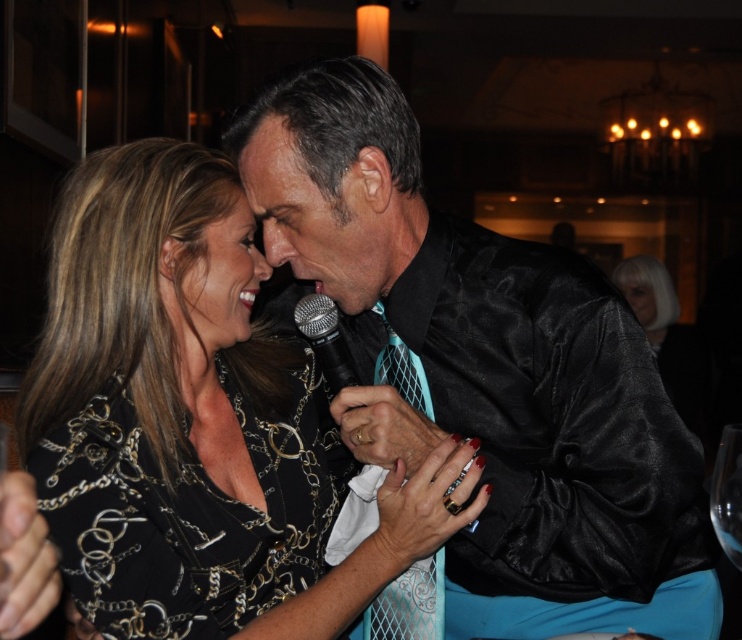
Which is more to the right, transparent glass at lower right or black metallic microphone at center?

transparent glass at lower right

Does transparent glass at lower right appear over black metallic microphone at center?

Incorrect, transparent glass at lower right is not positioned above black metallic microphone at center.

Locate an element on the screen. transparent glass at lower right is located at coordinates (728, 515).

Between point (692, 618) and point (177, 417), which one is positioned in front?

Point (177, 417) is more forward.

Is point (338, 64) more distant than point (70, 554)?

That is True.

Locate an element on the screen. This screenshot has height=640, width=742. black satin shirt at center is located at coordinates (487, 372).

Can you confirm if silvery metallic jacket at upper right is positioned to the right of black metallic microphone at center?

Correct, you'll find silvery metallic jacket at upper right to the right of black metallic microphone at center.

Does point (706, 388) come behind point (332, 349)?

Yes, it is.

Locate an element on the screen. The image size is (742, 640). silvery metallic jacket at upper right is located at coordinates (666, 337).